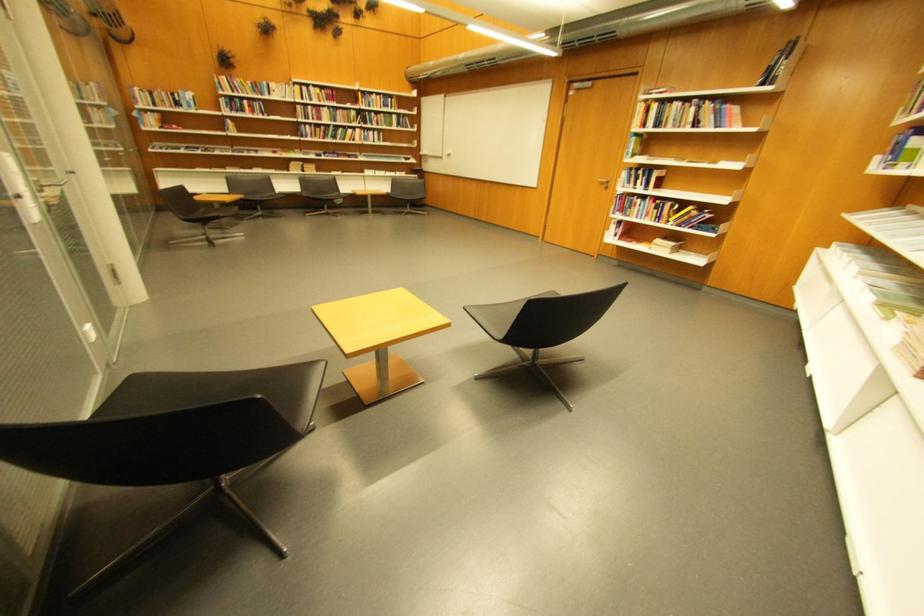
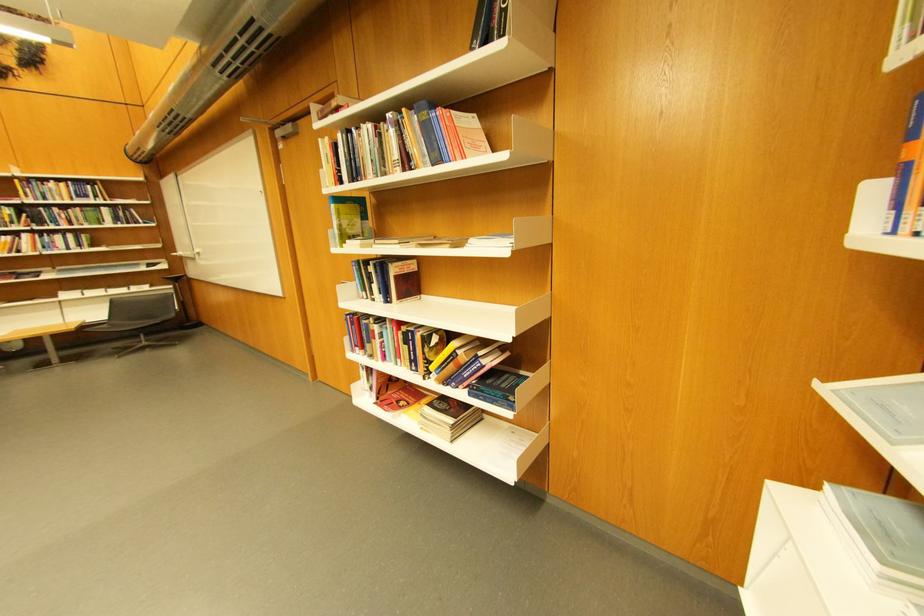
Find the pixel in the second image that matches (x=845, y=245) in the first image.

(837, 485)